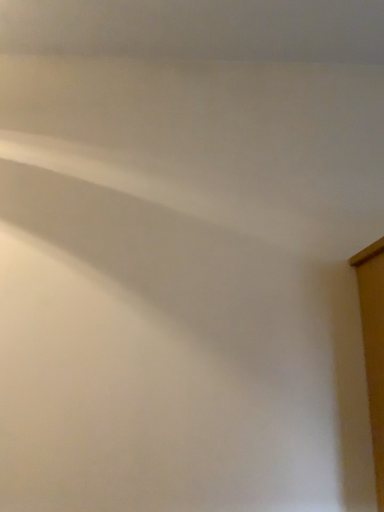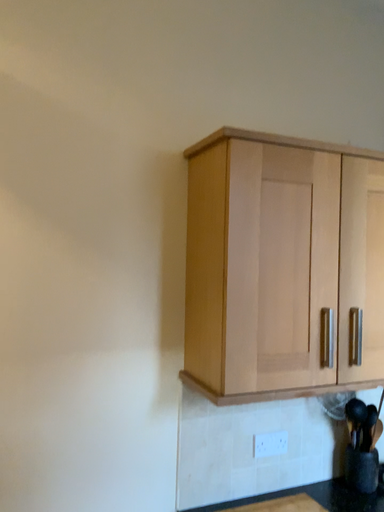
Question: How did the camera likely rotate when shooting the video?

Choices:
 (A) rotated left
 (B) rotated right

Answer: (B)